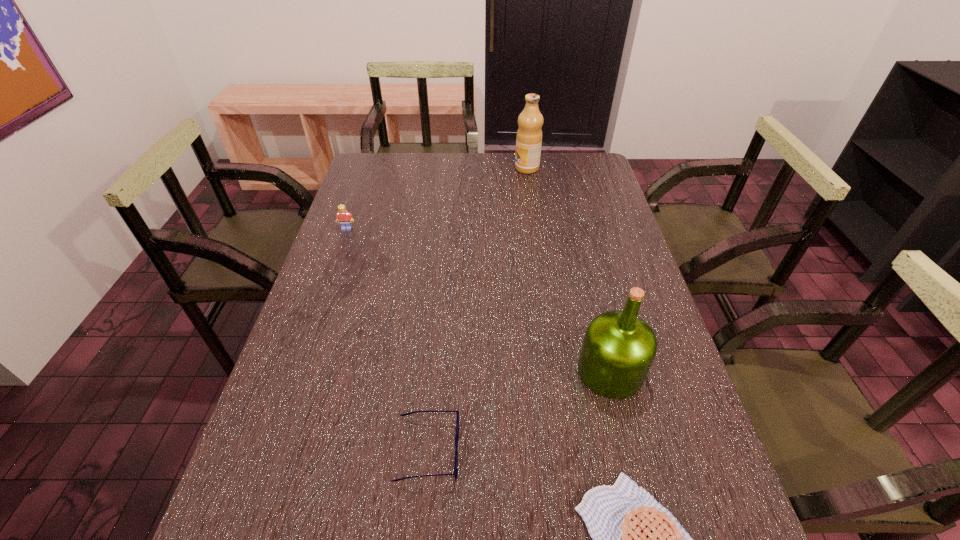
This screenshot has height=540, width=960. I want to click on vacant space located 0.340m on the left of the right olive oil, so click(x=433, y=371).

This screenshot has height=540, width=960. I want to click on vacant region located on the front-facing side of the third tallest object, so click(341, 247).

Identify the location of free space located 0.180m on the front-facing side of the spectacles. (547, 449).

You are a GUI agent. You are given a task and a screenshot of the screen. Output one action in this format:
    pyautogui.click(x=<x>, y=<y>)
    Task: Click on the object located at the far edge
    The height and width of the screenshot is (540, 960).
    Given the screenshot: What is the action you would take?
    pyautogui.click(x=529, y=134)

Find the location of a particular element. The image size is (960, 540). object located at the left edge is located at coordinates (343, 216).

Where is `object that is at the right edge`? The width and height of the screenshot is (960, 540). object that is at the right edge is located at coordinates (619, 347).

In the image, there is a desktop. Identify the location of blank space at the far edge. (422, 168).

In the image, there is a desktop. In order to click on vacant space at the left edge in this screenshot , I will do `click(342, 319)`.

This screenshot has width=960, height=540. In the image, there is a desktop. In order to click on vacant space at the right edge in this screenshot , I will do `click(684, 416)`.

In the image, there is a desktop. Where is `vacant space at the far left corner`? This screenshot has width=960, height=540. vacant space at the far left corner is located at coordinates (376, 175).